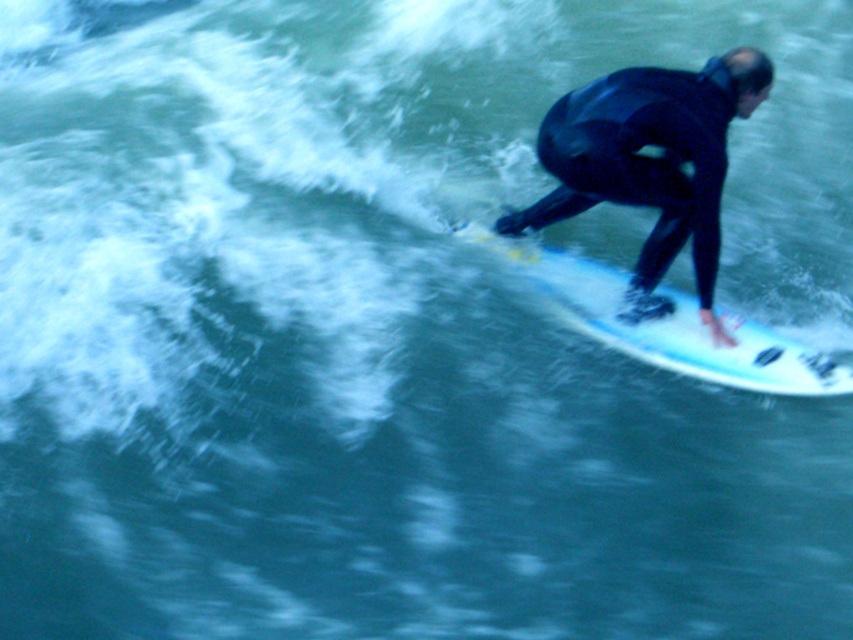
Can you confirm if black matte wetsuit at center is bigger than white glossy surfboard at right?

Actually, black matte wetsuit at center might be smaller than white glossy surfboard at right.

Identify the location of black matte wetsuit at center. (641, 161).